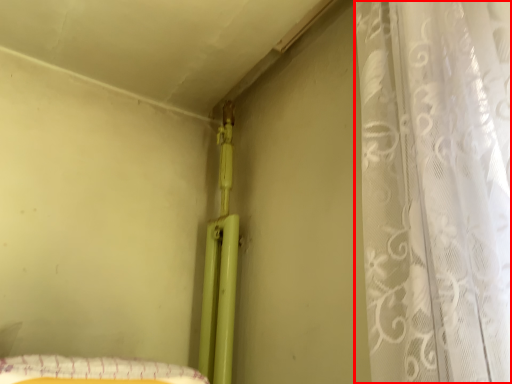
Question: Observing the image, what is the correct spatial positioning of curtain (annotated by the red box) in reference to sheet?

Choices:
 (A) left
 (B) right

Answer: (B)